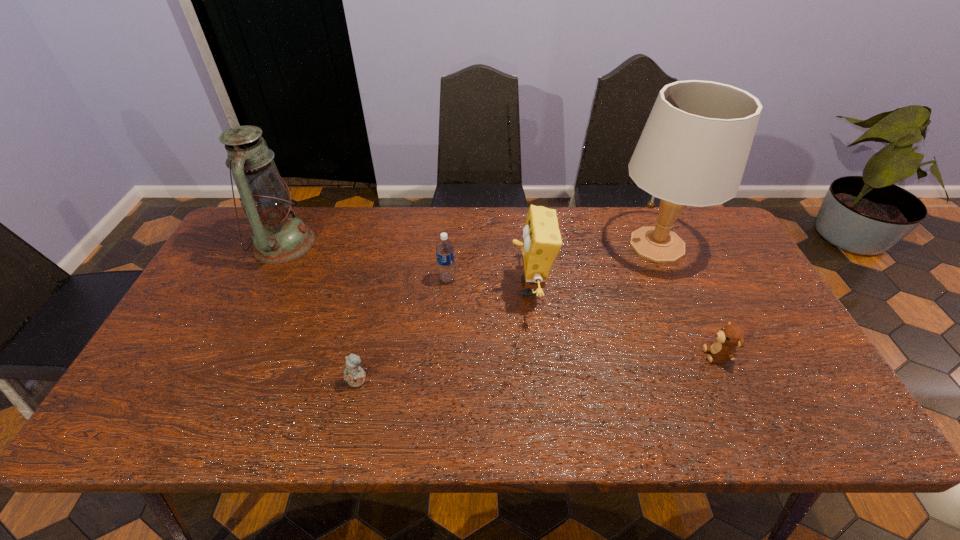
The height and width of the screenshot is (540, 960). In order to click on table lamp in this screenshot , I will do `click(693, 150)`.

Image resolution: width=960 pixels, height=540 pixels. I want to click on the leftmost object, so click(278, 237).

Find the location of a particular element. The height and width of the screenshot is (540, 960). the third object from right to left is located at coordinates (541, 244).

Identify the location of sponge. (541, 244).

The height and width of the screenshot is (540, 960). I want to click on the fourth tallest object, so click(444, 249).

The height and width of the screenshot is (540, 960). What are the coordinates of `the fourth object from right to left` in the screenshot? It's located at (444, 249).

Locate an element on the screen. Image resolution: width=960 pixels, height=540 pixels. the right teddy bear is located at coordinates (732, 335).

Identify the location of the farther teddy bear. (732, 335).

What are the coordinates of `the nearest object` in the screenshot? It's located at (355, 376).

This screenshot has height=540, width=960. Identify the location of the second object from left to right. (355, 376).